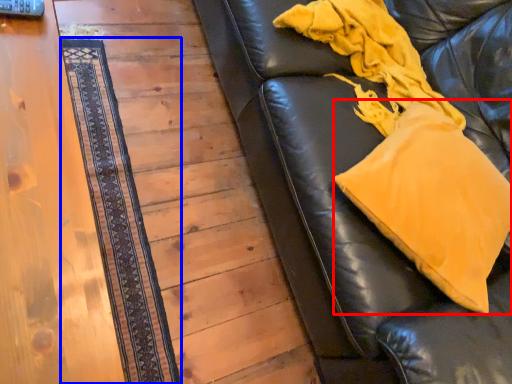
Question: Which point is closer to the camera, throw pillow (highlighted by a red box) or mat (highlighted by a blue box)?

Choices:
 (A) throw pillow
 (B) mat

Answer: (A)